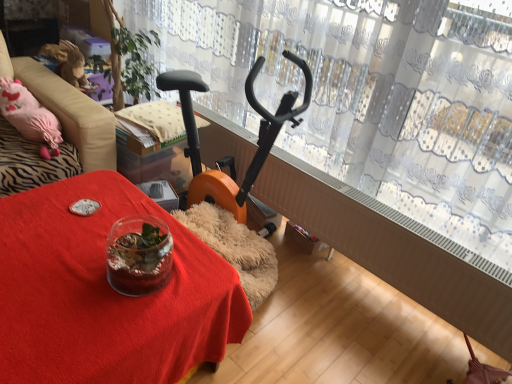
You are a GUI agent. You are given a task and a screenshot of the screen. Output one action in this format:
    pyautogui.click(x=<x>, y=<y>)
    Task: Click on the vacant region above translucent glass terrarium at center (from a real-world perspective)
    The height and width of the screenshot is (384, 512).
    Given the screenshot: What is the action you would take?
    pyautogui.click(x=82, y=256)